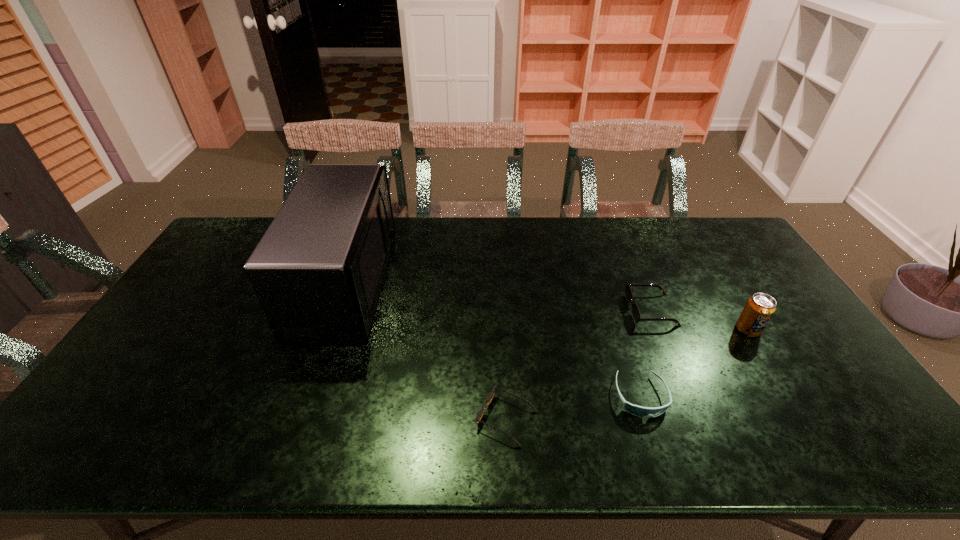
Find the location of a particular element. The width and height of the screenshot is (960, 540). the leftmost object is located at coordinates (318, 271).

You are a GUI agent. You are given a task and a screenshot of the screen. Output one action in this format:
    pyautogui.click(x=<x>, y=<y>)
    Task: Click on the tallest object
    The width and height of the screenshot is (960, 540).
    Given the screenshot: What is the action you would take?
    pyautogui.click(x=318, y=271)

The width and height of the screenshot is (960, 540). I want to click on the rightmost object, so click(759, 309).

At what (x,y) coordinates should I click in order to perform the action: click on the fourth shortest object. Please return your answer as a coordinate pair (x, y). The width and height of the screenshot is (960, 540). Looking at the image, I should click on (759, 309).

At what (x,y) coordinates should I click in order to perform the action: click on the right sunglasses. Please return your answer as a coordinate pair (x, y). This screenshot has width=960, height=540. Looking at the image, I should click on (628, 292).

Where is `the taller sunglasses`? This screenshot has width=960, height=540. the taller sunglasses is located at coordinates (628, 292).

Find the location of a particular element. The height and width of the screenshot is (540, 960). goggles is located at coordinates (636, 410).

This screenshot has width=960, height=540. In order to click on the shorter sunglasses in this screenshot , I will do `click(489, 398)`.

Find the location of `the left sunglasses`. the left sunglasses is located at coordinates (489, 398).

What are the coordinates of `free space located on the front-facing side of the microwave_oven` in the screenshot? It's located at (435, 284).